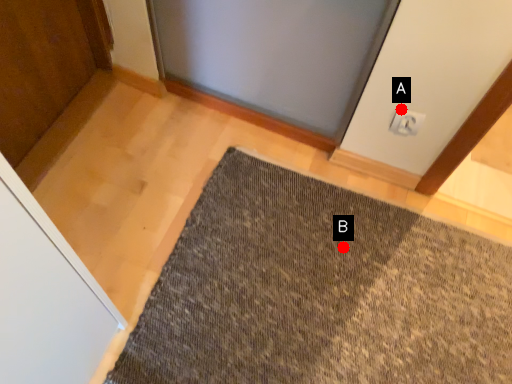
Question: Two points are circled on the image, labeled by A and B beside each circle. Among these points, which one is nearest to the camera?

Choices:
 (A) A is closer
 (B) B is closer

Answer: (A)